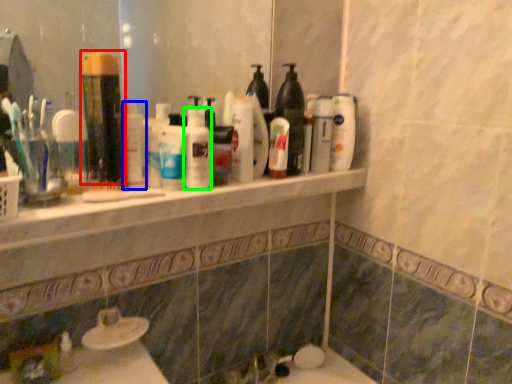
Question: Which is nearer to the mouthwash (highlighted by a red box)? cleaning product (highlighted by a blue box) or cleaning product (highlighted by a green box).

Choices:
 (A) cleaning product
 (B) cleaning product

Answer: (A)